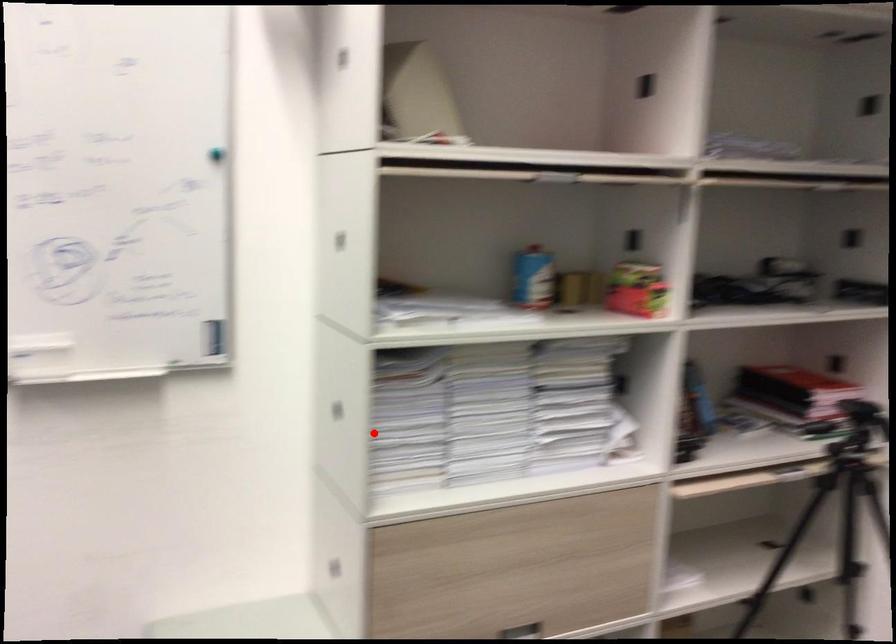
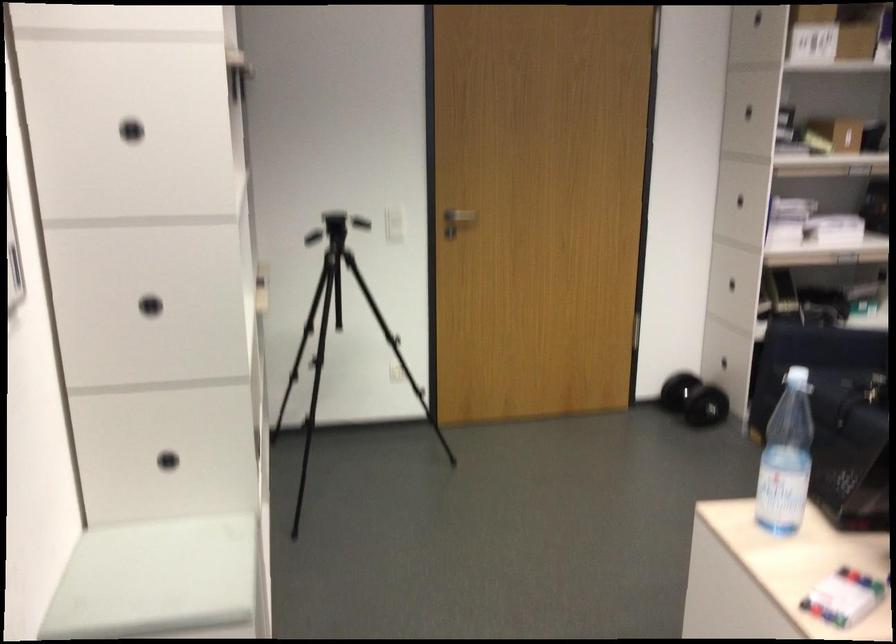
Locate, in the second image, the point that corresponds to the highlighted location in the first image.

(150, 305)